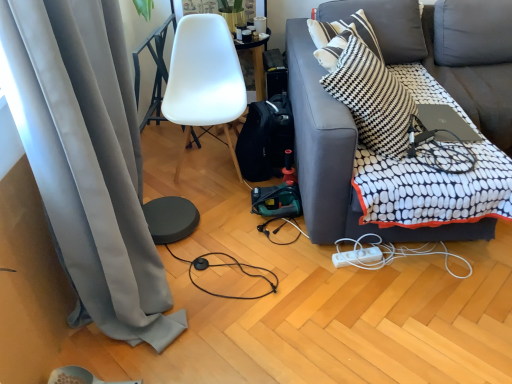
I want to click on unoccupied region to the right of black cable at lower center, so click(x=308, y=294).